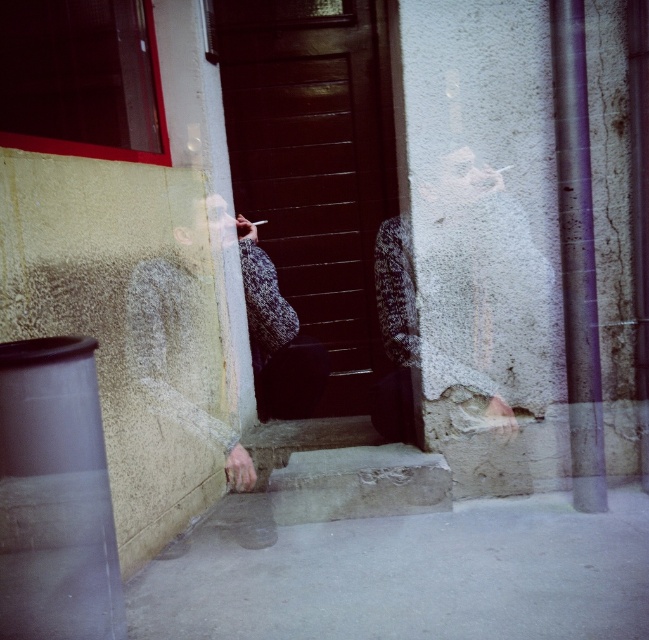
You are a delivery person trying to deliver a package to the apartment behind the dark wood door at center. The package is too large to fit through the space between the door and the white matte cigarette at center. Can you estimate the minimum width the package must be to not fit through that space?

The dark wood door at center is larger than the white matte cigarette at center, so the space between them is narrower than the door. The package must be wider than the narrowest point between the door and the cigarette to not fit through.

You are a delivery person trying to locate the correct apartment. You see the dark wood door at center and the white matte cigarette at center. Which object is closer to the left side of the frame?

The white matte cigarette at center is closer to the left side of the frame because the dark wood door at center is to the right of it.